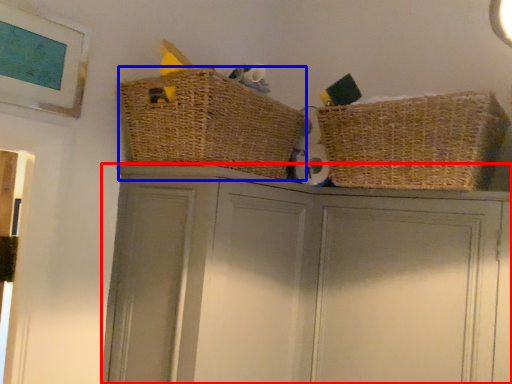
Question: Which of the following is the closest to the observer, cupboard (highlighted by a red box) or basket (highlighted by a blue box)?

Choices:
 (A) cupboard
 (B) basket

Answer: (A)